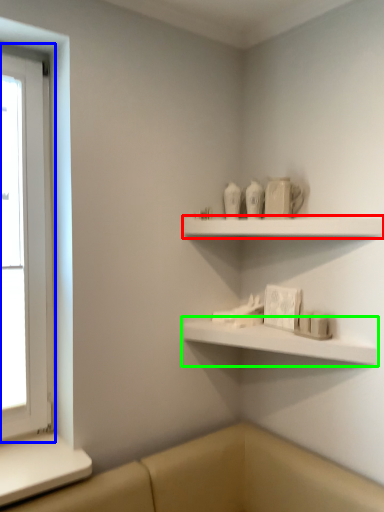
Question: Based on their relative distances, which object is farther from shelf (highlighted by a red box)? Choose from window (highlighted by a blue box) and shelf (highlighted by a green box).

Choices:
 (A) window
 (B) shelf

Answer: (A)